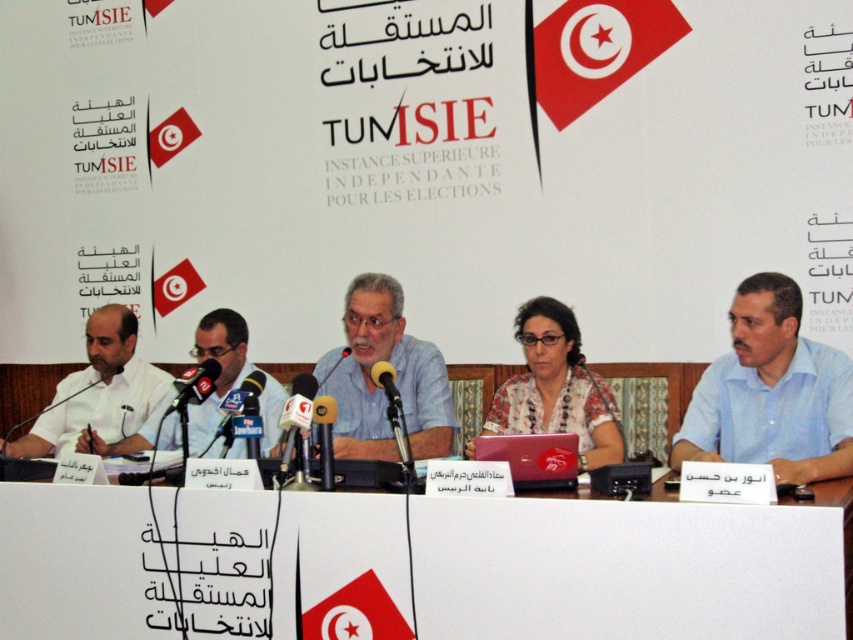
Question: Can you confirm if blue cotton shirt at right is bigger than black plastic microphone at left?

Choices:
 (A) yes
 (B) no

Answer: (B)

Question: Among these objects, which one is nearest to the camera?

Choices:
 (A) white paper at left
 (B) black plastic microphone at left

Answer: (B)

Question: Which point is closer to the camera?

Choices:
 (A) metallic silver microphone at center
 (B) matte black laptop at center
 (C) floral fabric shirt at center

Answer: (B)

Question: Which point is farther to the camera?

Choices:
 (A) floral fabric shirt at center
 (B) metallic silver microphone at center
 (C) metallic/metallic microphone at center

Answer: (A)

Question: Is gray fabric shirt at center smaller than matte black laptop at center?

Choices:
 (A) yes
 (B) no

Answer: (B)

Question: Can you confirm if blue cotton shirt at right is positioned above gray fabric shirt at center?

Choices:
 (A) no
 (B) yes

Answer: (A)